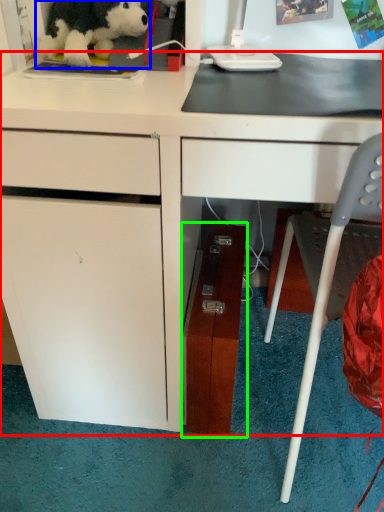
Question: Which is nearer to the desk (highlighted by a red box)? toy (highlighted by a blue box) or file cabinet (highlighted by a green box).

Choices:
 (A) toy
 (B) file cabinet

Answer: (B)